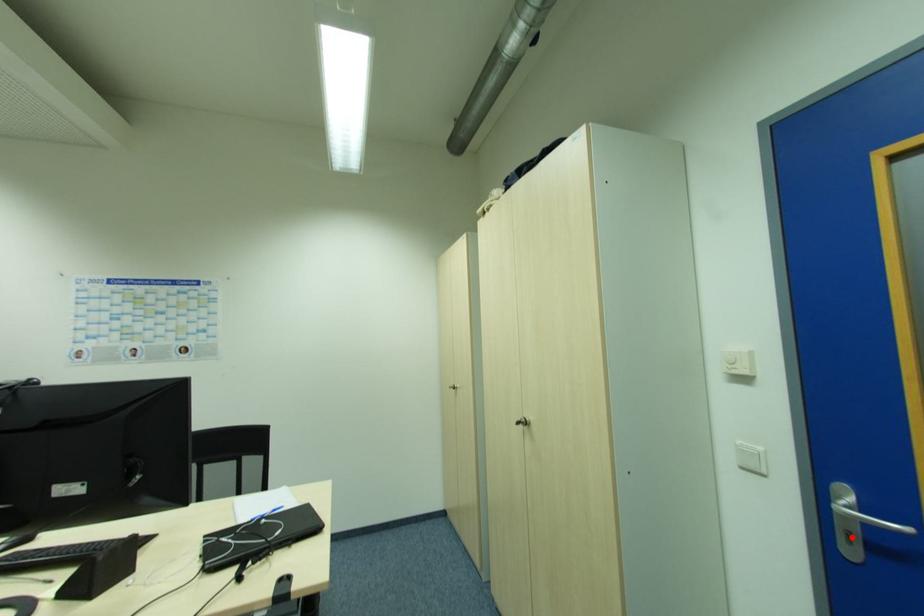
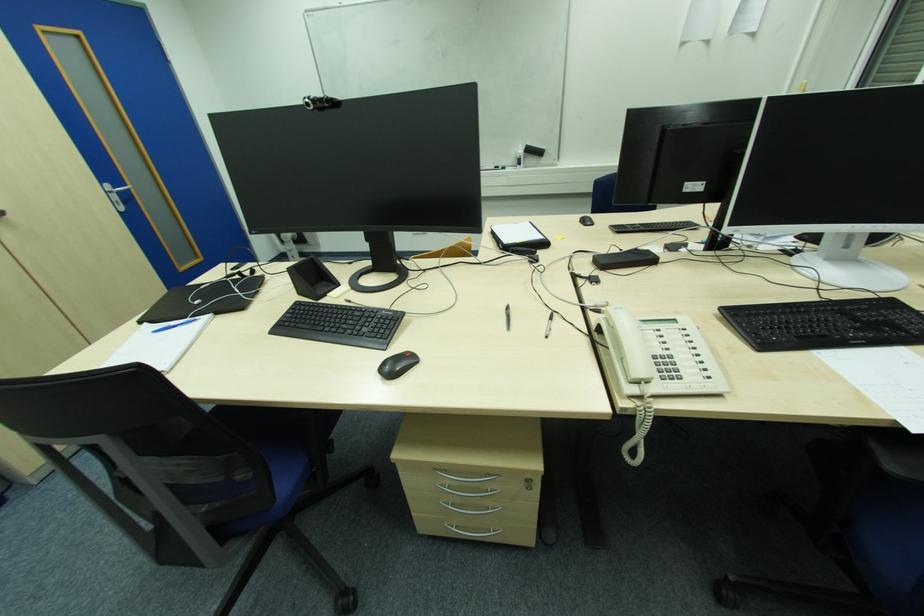
Question: I am providing you with two images of the same scene from different viewpoints. Given a red point in image1, look at the same physical point in image2. Is it:

Choices:
 (A) Closer to the viewpoint
 (B) Farther from the viewpoint

Answer: (B)